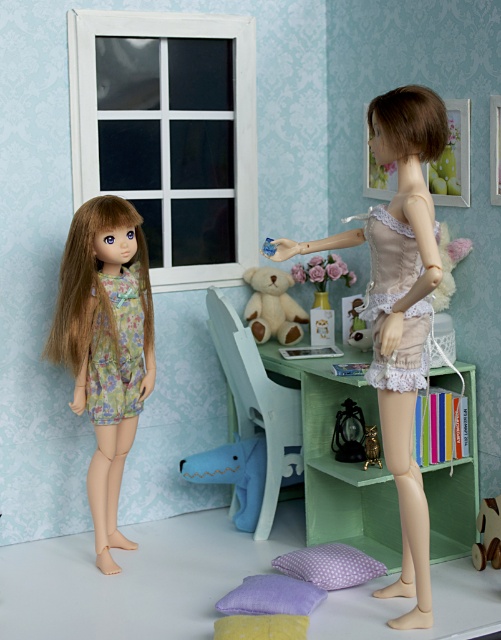
You are a doll trying to reach the matte beige lace dress at center from the green desk with a chair tucked underneath. Can you move directly to the dress without any obstacles?

The matte beige lace dress at center is located at point (399, 310), so yes, the doll can move directly to the dress without any obstacles since there are no mentioned objects blocking the path between the green desk and the dress.

You are a doll trying to decide where to place a new small toy. The soft beige plush at center and the wooden horse at lower right are already in the room. Which object can you place a new small toy next to without it being completely hidden?

The soft beige plush at center is bigger than the wooden horse at lower right, so placing the new small toy next to the wooden horse at lower right would be less likely to hide it completely.